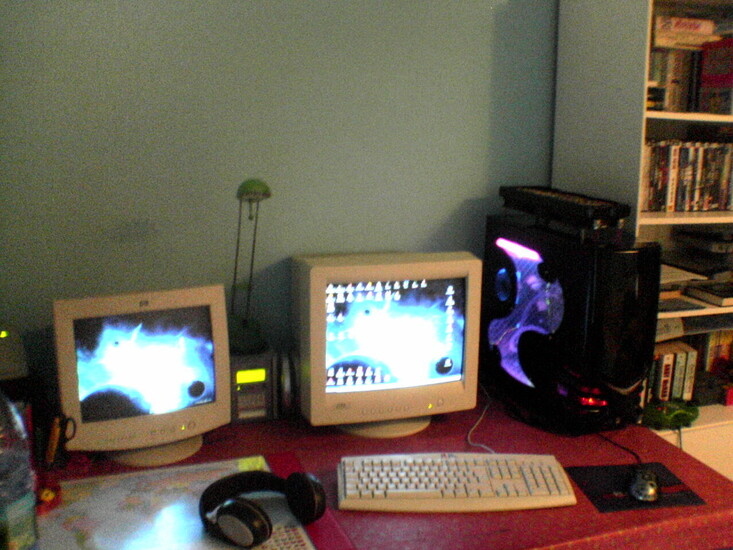
Identify the location of wall. The width and height of the screenshot is (733, 550). (144, 214), (344, 185), (415, 160).